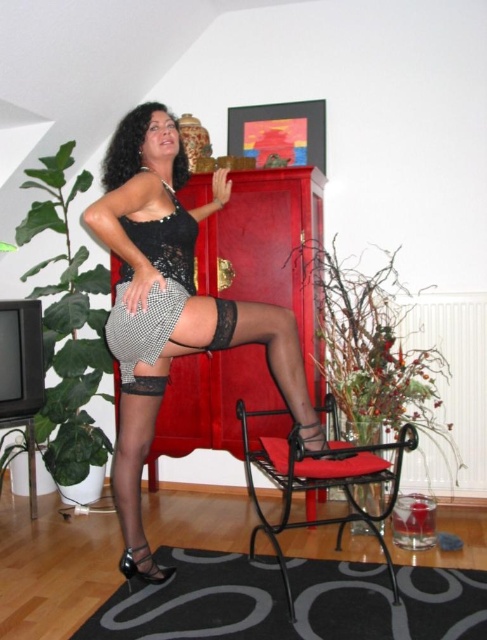
Which is more to the left, black lace dress at center or black lace shorts at center?

From the viewer's perspective, black lace dress at center appears more on the left side.

Where is `black lace dress at center`? black lace dress at center is located at coordinates (152, 294).

Measure the distance between black lace dress at center and camera.

black lace dress at center and camera are 1.98 meters apart from each other.

At what (x,y) coordinates should I click in order to perform the action: click on black lace dress at center. Please return your answer as a coordinate pair (x, y). The width and height of the screenshot is (487, 640). Looking at the image, I should click on (152, 294).

Does point (351, 468) come in front of point (222, 300)?

Yes, it is in front of point (222, 300).

Find the location of a particular element. black metal armchair at center is located at coordinates (320, 477).

You are a GUI agent. You are given a task and a screenshot of the screen. Output one action in this format:
    pyautogui.click(x=<x>, y=<y>)
    Task: Click on the matte black stockings at center
    The height and width of the screenshot is (640, 487).
    Given the screenshot: What is the action you would take?
    pyautogui.click(x=149, y=294)

Is matte black stockings at center below black metal armchair at center?

No.

Is point (210, 337) less distant than point (318, 458)?

Yes, point (210, 337) is closer to viewer.

At what (x,y) coordinates should I click in order to perform the action: click on matte black stockings at center. Please return your answer as a coordinate pair (x, y). Looking at the image, I should click on (149, 294).